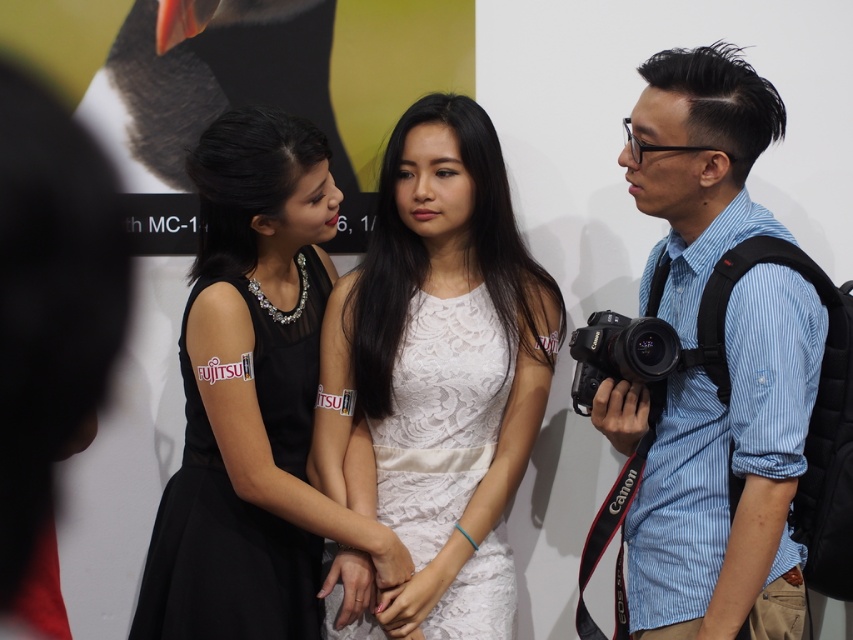
Which of these two, blue striped shirt at right or white lace dress at center, stands shorter?

With less height is white lace dress at center.

Between point (688, 180) and point (395, 502), which one is positioned in front?

Point (688, 180) is in front.

I want to click on blue striped shirt at right, so click(726, 474).

Which is more to the right, white lace dress at center or black plastic camera at right?

black plastic camera at right is more to the right.

Which is behind, point (375, 419) or point (614, 342)?

The point (375, 419) is more distant.

This screenshot has height=640, width=853. I want to click on white lace dress at center, so click(440, 417).

Is black lace dress at center below white lace dress at center?

Actually, black lace dress at center is above white lace dress at center.

How distant is black lace dress at center from white lace dress at center?

black lace dress at center is 24.22 centimeters from white lace dress at center.

Locate an element on the screen. Image resolution: width=853 pixels, height=640 pixels. black lace dress at center is located at coordinates (239, 499).